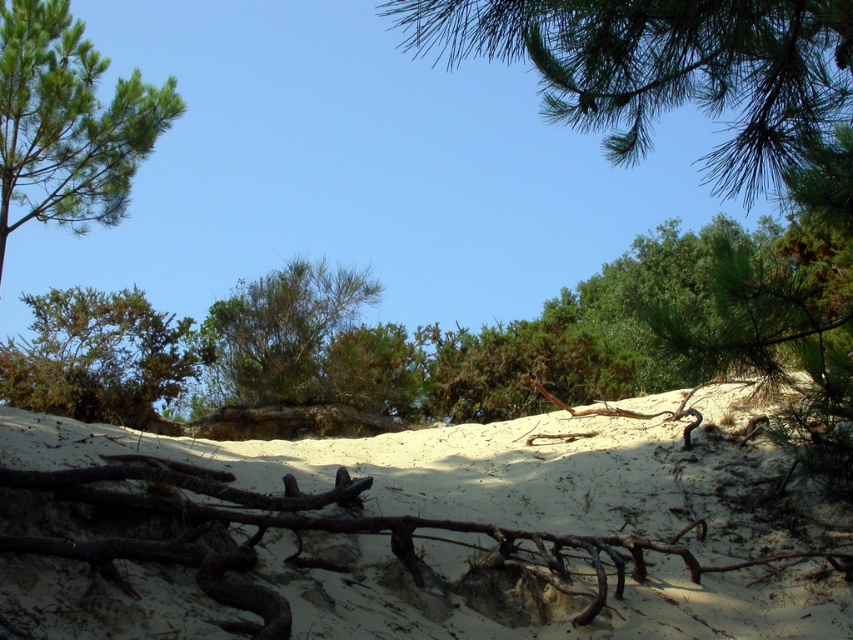
You are standing in the middle of the sandy landscape and want to determine which object is taller between the light beige sand at center and the green leafy tree at center. Based on the scene, which one is taller?

The green leafy tree at center is taller than the light beige sand at center.

You are standing at the edge of the sandy landscape and want to place a small marker exactly where the light beige sand at center is located. According to the coordinates provided, what are the coordinates where you should place the marker?

The coordinates for the light beige sand at center are point (413, 534).